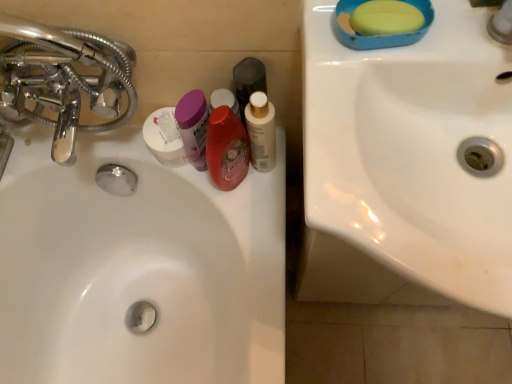
Identify the location of vacant area in front of yellow matte soap at upper right. This screenshot has width=512, height=384. (352, 120).